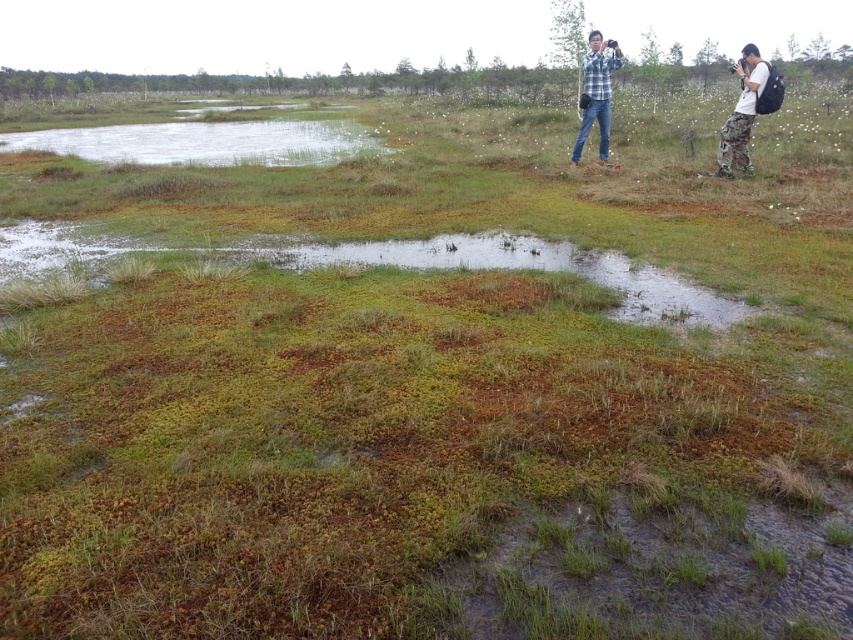
Question: Observing the image, what is the correct spatial positioning of blue plaid shirt at upper center in reference to blue plaid shirt at upper right?

Choices:
 (A) left
 (B) right

Answer: (B)

Question: Estimate the real-world distances between objects in this image. Which object is farther from the blue plaid shirt at upper right?

Choices:
 (A) camouflage pants at right
 (B) blue plaid shirt at upper center

Answer: (A)

Question: Which is nearer to the camouflage pants at right?

Choices:
 (A) blue plaid shirt at upper right
 (B) blue plaid shirt at upper center

Answer: (B)

Question: From the image, what is the correct spatial relationship of blue plaid shirt at upper right in relation to camouflage pants at right?

Choices:
 (A) right
 (B) left

Answer: (B)

Question: Which object is positioned farthest from the blue plaid shirt at upper center?

Choices:
 (A) blue plaid shirt at upper right
 (B) camouflage pants at right

Answer: (A)

Question: Does blue plaid shirt at upper right have a larger size compared to camouflage pants at right?

Choices:
 (A) no
 (B) yes

Answer: (A)